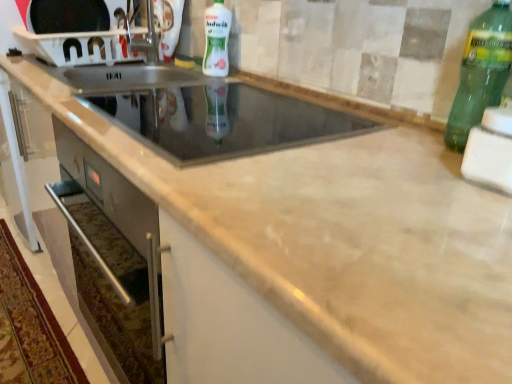
How much space does glass stovetop at center, which is the second appliance in bottom-to-top order, occupy horizontally?

20.77 inches.

Measure the distance between point [159,141] and camera.

Point [159,141] is 34.76 inches from camera.

Locate an element on the screen. glass stovetop at center, acting as the 2th appliance starting from the back is located at coordinates (222, 121).

Which object is thinner, white foam sponge at right, which appears as the third appliance when viewed from the back, or white glossy bottle at upper center, arranged as the 2th bottle when viewed from the front?

Thinner between the two is white foam sponge at right, which appears as the third appliance when viewed from the back.

Is white foam sponge at right, the third appliance from the left, behind white glossy bottle at upper center, positioned as the second bottle in right-to-left order?

No, white foam sponge at right, the third appliance from the left, is closer to the camera.

Where is `the 2nd bottle behind the white foam sponge at right, the third appliance from the left`? The width and height of the screenshot is (512, 384). the 2nd bottle behind the white foam sponge at right, the third appliance from the left is located at coordinates (216, 39).

Is white foam sponge at right, acting as the first appliance starting from the right, placed right next to white glossy bottle at upper center, arranged as the 2th bottle when viewed from the front?

→ white foam sponge at right, acting as the first appliance starting from the right, and white glossy bottle at upper center, arranged as the 2th bottle when viewed from the front, are clearly separated.

From the image's perspective, between glass stovetop at center, the second appliance positioned from the top, and green glass bottle at right, placed as the first bottle when sorted from right to left, who is located below?

glass stovetop at center, the second appliance positioned from the top.

Does glass stovetop at center, the second appliance from the front, turn towards green glass bottle at right, which is counted as the second bottle, starting from the back?

No, glass stovetop at center, the second appliance from the front, does not turn towards green glass bottle at right, which is counted as the second bottle, starting from the back.

Is glass stovetop at center, which appears as the second appliance when viewed from the right, in front of or behind green glass bottle at right, which is counted as the second bottle, starting from the back, in the image?

glass stovetop at center, which appears as the second appliance when viewed from the right, is positioned closer to the viewer than green glass bottle at right, which is counted as the second bottle, starting from the back.

Considering the sizes of objects glass stovetop at center, which is counted as the 2th appliance, starting from the left, and green glass bottle at right, which is counted as the second bottle, starting from the back, in the image provided, who is wider, glass stovetop at center, which is counted as the 2th appliance, starting from the left, or green glass bottle at right, which is counted as the second bottle, starting from the back,?

glass stovetop at center, which is counted as the 2th appliance, starting from the left.

Considering the sizes of objects white plastic microwave at upper left, placed as the first appliance when sorted from top to bottom, and glass stovetop at center, the second appliance from the front, in the image provided, who is wider, white plastic microwave at upper left, placed as the first appliance when sorted from top to bottom, or glass stovetop at center, the second appliance from the front,?

With larger width is glass stovetop at center, the second appliance from the front.

Relative to glass stovetop at center, acting as the 2th appliance starting from the back, is white plastic microwave at upper left, marked as the 1th appliance in a back-to-front arrangement, in front or behind?

In the image, white plastic microwave at upper left, marked as the 1th appliance in a back-to-front arrangement, appears behind glass stovetop at center, acting as the 2th appliance starting from the back.

Considering the sizes of objects white plastic microwave at upper left, arranged as the first appliance when viewed from the left, and glass stovetop at center, which is the second appliance in bottom-to-top order, in the image provided, who is bigger, white plastic microwave at upper left, arranged as the first appliance when viewed from the left, or glass stovetop at center, which is the second appliance in bottom-to-top order,?

glass stovetop at center, which is the second appliance in bottom-to-top order.

Is white plastic microwave at upper left, the third appliance viewed from the front, not inside glass stovetop at center, acting as the 2th appliance starting from the back?

white plastic microwave at upper left, the third appliance viewed from the front, is positioned outside glass stovetop at center, acting as the 2th appliance starting from the back.

Considering the sizes of green glass bottle at right, placed as the first bottle when sorted from right to left, and glass stovetop at center, which appears as the second appliance when viewed from the right, in the image, is green glass bottle at right, placed as the first bottle when sorted from right to left, taller or shorter than glass stovetop at center, which appears as the second appliance when viewed from the right,?

Clearly, green glass bottle at right, placed as the first bottle when sorted from right to left, is taller compared to glass stovetop at center, which appears as the second appliance when viewed from the right.

Would you say green glass bottle at right, placed as the first bottle when sorted from right to left, is to the left or to the right of glass stovetop at center, which appears as the second appliance when viewed from the right, in the picture?

From the image, it's evident that green glass bottle at right, placed as the first bottle when sorted from right to left, is to the right of glass stovetop at center, which appears as the second appliance when viewed from the right.

Looking at this image, is green glass bottle at right, placed as the first bottle when sorted from right to left, looking in the opposite direction of glass stovetop at center, the second appliance positioned from the top?

green glass bottle at right, placed as the first bottle when sorted from right to left, does not have its back to glass stovetop at center, the second appliance positioned from the top.

Does point (319, 113) come farther from viewer compared to point (32, 18)?

No.

The image size is (512, 384). What are the coordinates of `the 1st appliance in front of the white plastic microwave at upper left, which ranks as the third appliance in right-to-left order, starting your count from the anchor` in the screenshot? It's located at (222, 121).

From the image's perspective, is glass stovetop at center, the second appliance positioned from the top, positioned above or below white plastic microwave at upper left, arranged as the third appliance when ordered from the bottom?

Clearly, from the image's perspective, glass stovetop at center, the second appliance positioned from the top, is below white plastic microwave at upper left, arranged as the third appliance when ordered from the bottom.

From a real-world perspective, is glass stovetop at center, acting as the 2th appliance starting from the back, physically above white foam sponge at right, acting as the first appliance starting from the right?

No, from a real-world perspective, glass stovetop at center, acting as the 2th appliance starting from the back, is not above white foam sponge at right, acting as the first appliance starting from the right.

Identify the location of appliance below the white foam sponge at right, positioned as the 1th appliance in bottom-to-top order (from a real-world perspective). (222, 121).

Is glass stovetop at center, the second appliance from the front, at the left side of white foam sponge at right, marked as the 1th appliance in a front-to-back arrangement?

Yes.

Can you tell me how much glass stovetop at center, the second appliance positioned from the top, and white foam sponge at right, the third appliance from the left, differ in facing direction?

The facing directions of glass stovetop at center, the second appliance positioned from the top, and white foam sponge at right, the third appliance from the left, are 0.592 degrees apart.

Are white glossy bottle at upper center, which is the 1th bottle in top-to-bottom order, and white plastic microwave at upper left, placed as the first appliance when sorted from top to bottom, far apart?

That's not correct — white glossy bottle at upper center, which is the 1th bottle in top-to-bottom order, is a little close to white plastic microwave at upper left, placed as the first appliance when sorted from top to bottom.

Does point (225, 22) come farther from viewer compared to point (116, 28)?

No, it is in front of (116, 28).

Which is correct: white glossy bottle at upper center, which appears as the 2th bottle when ordered from the bottom, is inside white plastic microwave at upper left, arranged as the third appliance when ordered from the bottom, or outside of it?

The correct answer is: outside.

From a real-world perspective, is white glossy bottle at upper center, which appears as the 2th bottle when ordered from the bottom, below white plastic microwave at upper left, placed as the first appliance when sorted from top to bottom?

Actually, white glossy bottle at upper center, which appears as the 2th bottle when ordered from the bottom, is physically above white plastic microwave at upper left, placed as the first appliance when sorted from top to bottom, in the real world.

The height and width of the screenshot is (384, 512). What are the coordinates of `the 1st bottle directly above the white foam sponge at right, positioned as the 1th appliance in bottom-to-top order (from a real-world perspective)` in the screenshot? It's located at (216, 39).

Where is `bottle on the right of glass stovetop at center, which is the second appliance in bottom-to-top order`? The height and width of the screenshot is (384, 512). bottle on the right of glass stovetop at center, which is the second appliance in bottom-to-top order is located at coordinates (481, 72).

Looking at the image, which one is located further to white glossy bottle at upper center, the first bottle viewed from the left, glass stovetop at center, which is counted as the 2th appliance, starting from the left, or green glass bottle at right, placed as the first bottle when sorted from right to left?

green glass bottle at right, placed as the first bottle when sorted from right to left.

Looking at the image, which one is located further to white foam sponge at right, positioned as the 1th appliance in bottom-to-top order, green glass bottle at right, which is counted as the second bottle, starting from the back, or white glossy bottle at upper center, which is the 1th bottle in top-to-bottom order?

white glossy bottle at upper center, which is the 1th bottle in top-to-bottom order.

Based on their spatial positions, is white glossy bottle at upper center, acting as the 1th bottle starting from the back, or white foam sponge at right, positioned as the 1th appliance in bottom-to-top order, closer to green glass bottle at right, which appears as the second bottle when viewed from the left?

white foam sponge at right, positioned as the 1th appliance in bottom-to-top order, is closer to green glass bottle at right, which appears as the second bottle when viewed from the left.

Based on their spatial positions, is white foam sponge at right, the third appliance from the left, or white plastic microwave at upper left, arranged as the third appliance when ordered from the bottom, further from white glossy bottle at upper center, positioned as the second bottle in right-to-left order?

white foam sponge at right, the third appliance from the left, is further to white glossy bottle at upper center, positioned as the second bottle in right-to-left order.

Based on their spatial positions, is white plastic microwave at upper left, the third appliance viewed from the front, or glass stovetop at center, the second appliance from the front, closer to white foam sponge at right, the third appliance from the left?

glass stovetop at center, the second appliance from the front, is closer to white foam sponge at right, the third appliance from the left.

Based on their spatial positions, is glass stovetop at center, the second appliance positioned from the top, or white plastic microwave at upper left, which ranks as the third appliance in right-to-left order, further from green glass bottle at right, which is counted as the second bottle, starting from the back?

white plastic microwave at upper left, which ranks as the third appliance in right-to-left order, lies further to green glass bottle at right, which is counted as the second bottle, starting from the back, than the other object.

From the picture: Looking at the image, which one is located further to white foam sponge at right, marked as the 1th appliance in a front-to-back arrangement, white plastic microwave at upper left, which ranks as the third appliance in right-to-left order, or green glass bottle at right, the 2th bottle in the top-to-bottom sequence?

Based on the image, white plastic microwave at upper left, which ranks as the third appliance in right-to-left order, appears to be further to white foam sponge at right, marked as the 1th appliance in a front-to-back arrangement.

Which object lies nearer to the anchor point green glass bottle at right, which appears as the second bottle when viewed from the left, glass stovetop at center, which is the second appliance in bottom-to-top order, or white foam sponge at right, acting as the first appliance starting from the right?

Based on the image, white foam sponge at right, acting as the first appliance starting from the right, appears to be nearer to green glass bottle at right, which appears as the second bottle when viewed from the left.

Find the location of a particular element. The width and height of the screenshot is (512, 384). bottle between glass stovetop at center, which appears as the second appliance when viewed from the right, and white glossy bottle at upper center, arranged as the 2th bottle when viewed from the front, in the front-back direction is located at coordinates (481, 72).

Image resolution: width=512 pixels, height=384 pixels. Find the location of `bottle between white plastic microwave at upper left, placed as the first appliance when sorted from top to bottom, and white foam sponge at right, marked as the 1th appliance in a front-to-back arrangement, from left to right`. bottle between white plastic microwave at upper left, placed as the first appliance when sorted from top to bottom, and white foam sponge at right, marked as the 1th appliance in a front-to-back arrangement, from left to right is located at coordinates (216, 39).

I want to click on appliance positioned between white foam sponge at right, marked as the 1th appliance in a front-to-back arrangement, and white glossy bottle at upper center, positioned as the second bottle in right-to-left order, from near to far, so click(222, 121).

Locate an element on the screen. Image resolution: width=512 pixels, height=384 pixels. bottle between white plastic microwave at upper left, arranged as the third appliance when ordered from the bottom, and green glass bottle at right, placed as the first bottle when sorted from front to back, from left to right is located at coordinates (216, 39).